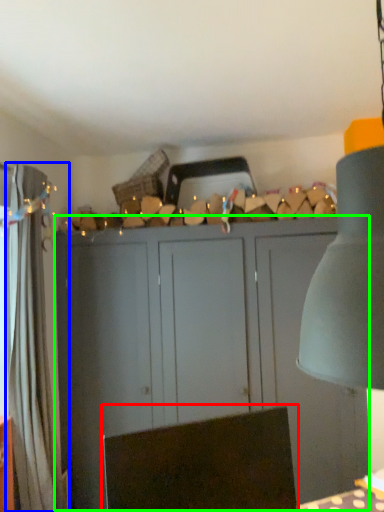
Question: Based on their relative distances, which object is farther from swivel chair (highlighted by a red box)? Choose from curtain (highlighted by a blue box) and cupboard (highlighted by a green box).

Choices:
 (A) curtain
 (B) cupboard

Answer: (B)